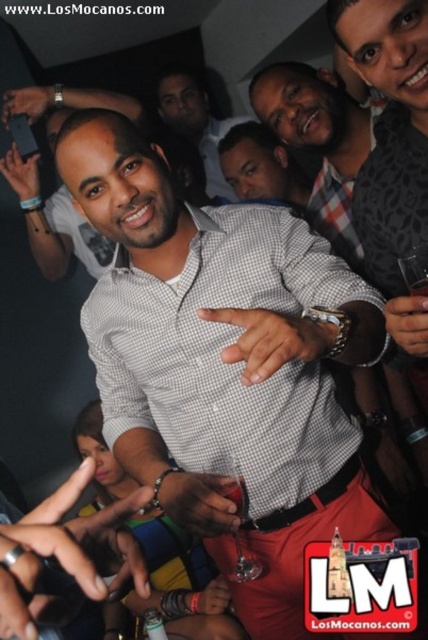
Question: Is white checkered shirt at center closer to camera compared to matte gray shirt at center?

Choices:
 (A) yes
 (B) no

Answer: (A)

Question: Estimate the real-world distances between objects in this image. Which object is closer to the matte gray shirt at center?

Choices:
 (A) checkered fabric shirt at center
 (B) checkered shirt at center

Answer: (A)

Question: Which point is closer to the camera taking this photo?

Choices:
 (A) (214, 148)
 (B) (253, 180)
 (C) (321, 177)
 (D) (139, 408)

Answer: (D)

Question: In this image, where is checkered shirt at center located relative to checkered fabric shirt at center?

Choices:
 (A) above
 (B) below

Answer: (B)

Question: Estimate the real-world distances between objects in this image. Which object is farther from the checkered fabric shirt at center?

Choices:
 (A) checkered shirt at center
 (B) white checkered shirt at center
 (C) matte gray shirt at center

Answer: (C)

Question: Does checkered fabric shirt at center appear on the left side of matte gray shirt at center?

Choices:
 (A) yes
 (B) no

Answer: (B)